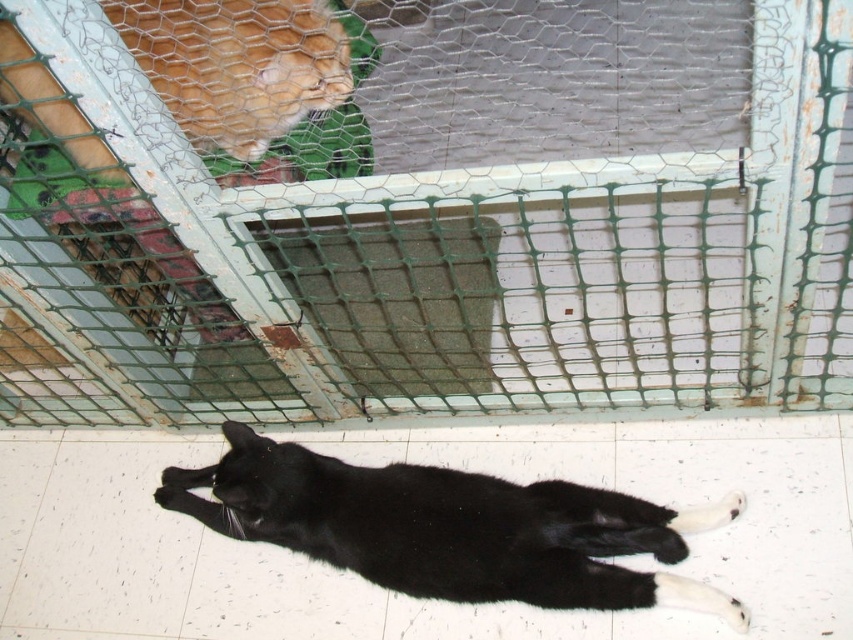
Question: Is green wire mesh at upper center below orange fur cat at upper left?

Choices:
 (A) no
 (B) yes

Answer: (A)

Question: Does black fur cat at lower center appear on the left side of orange fur cat at upper left?

Choices:
 (A) no
 (B) yes

Answer: (A)

Question: From the image, what is the correct spatial relationship of green wire mesh at upper center in relation to black fur cat at lower center?

Choices:
 (A) above
 (B) below

Answer: (A)

Question: Which of the following is the closest to the observer?

Choices:
 (A) orange fur cat at upper left
 (B) black fur cat at lower center

Answer: (A)

Question: Which of the following is the farthest from the observer?

Choices:
 (A) (180, 51)
 (B) (399, 348)
 (C) (223, 426)

Answer: (B)

Question: Considering the real-world distances, which object is farthest from the green wire mesh at upper center?

Choices:
 (A) orange fur cat at upper left
 (B) black fur cat at lower center

Answer: (B)